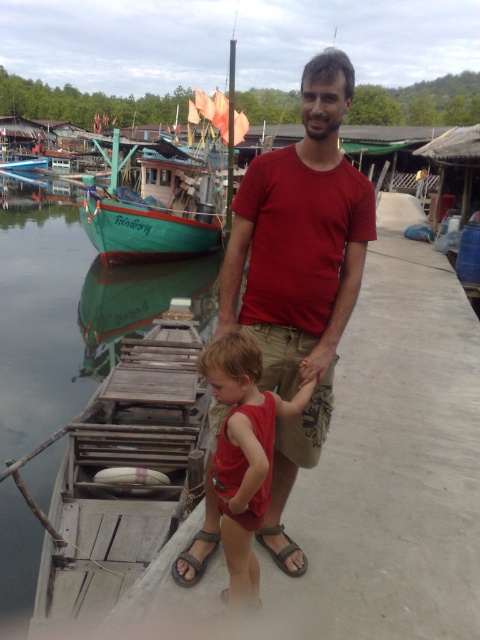
Question: Does matte red tank top at center appear under brown leather sandal at lower center?

Choices:
 (A) yes
 (B) no

Answer: (B)

Question: Which point appears closest to the camera in this image?

Choices:
 (A) (227, 438)
 (B) (200, 532)

Answer: (A)

Question: Does green reflective water at boat left have a lesser width compared to green matte boat at left?

Choices:
 (A) yes
 (B) no

Answer: (A)

Question: Can you confirm if green matte boat at left is positioned above brown leather sandal at lower center?

Choices:
 (A) yes
 (B) no

Answer: (A)

Question: Estimate the real-world distances between objects in this image. Which object is farther from the matte red t-shirt at center?

Choices:
 (A) brown leather sandal at lower center
 (B) green matte boat at left
 (C) matte red tank top at center

Answer: (B)

Question: Which object is farther from the camera taking this photo?

Choices:
 (A) brown fabric sandal at lower center
 (B) green matte boat at left
 (C) green reflective water at boat left

Answer: (B)